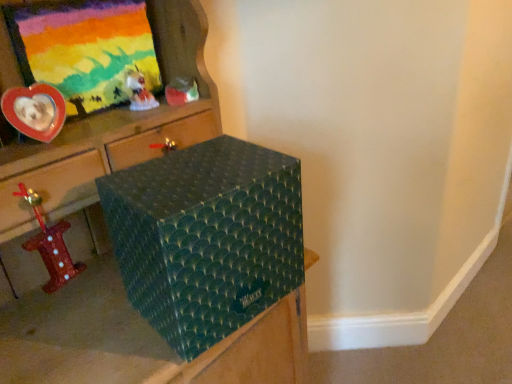
Question: From a real-world perspective, is metallic red number one at left, which ranks as the 1th toy in bottom-to-top order, physically located above or below matte plastic toy at upper center, placed as the first toy when sorted from back to front?

Choices:
 (A) above
 (B) below

Answer: (B)

Question: Which is correct: metallic red number one at left, positioned as the third toy in right-to-left order, is inside matte plastic toy at upper center, positioned as the 3th toy in left-to-right order, or outside of it?

Choices:
 (A) outside
 (B) inside

Answer: (A)

Question: Based on their relative distances, which object is farther from the metallic red number one at left, positioned as the third toy in right-to-left order?

Choices:
 (A) translucent plastic figurine at upper center, which appears as the 2th toy when viewed from the right
 (B) teal textured box at center
 (C) green textured box at center
 (D) matte plastic picture frame at upper left
 (E) matte plastic toy at upper center, which is counted as the 1th toy, starting from the top

Answer: (E)

Question: Which is nearer to the metallic red number one at left, arranged as the 3th toy when viewed from the back?

Choices:
 (A) teal textured box at center
 (B) green textured box at center
 (C) matte plastic picture frame at upper left
 (D) matte plastic toy at upper center, positioned as the 3th toy in left-to-right order
 (E) translucent plastic figurine at upper center, which is the 2th toy from bottom to top

Answer: (B)